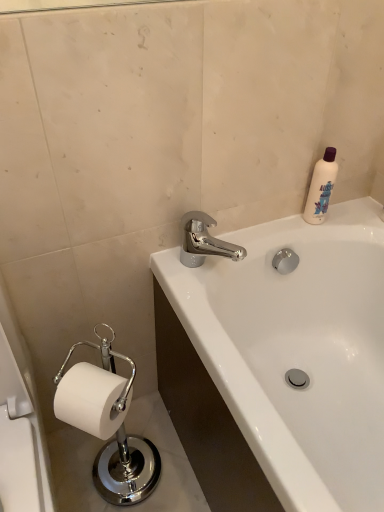
Locate an element on the screen. unoccupied region to the right of white plastic bottle at upper right is located at coordinates (357, 216).